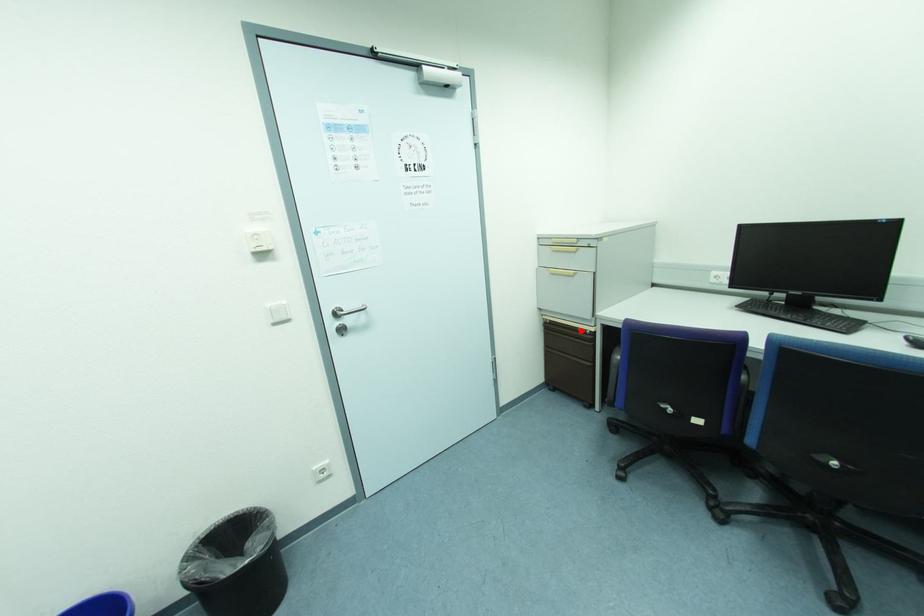
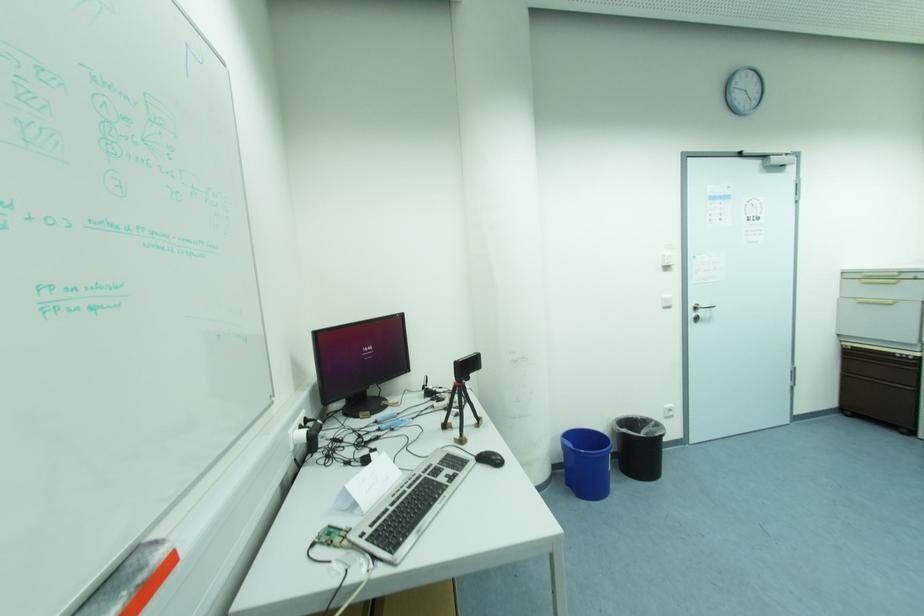
In the second image, find the point that corresponds to the highlighted location in the first image.

(898, 355)